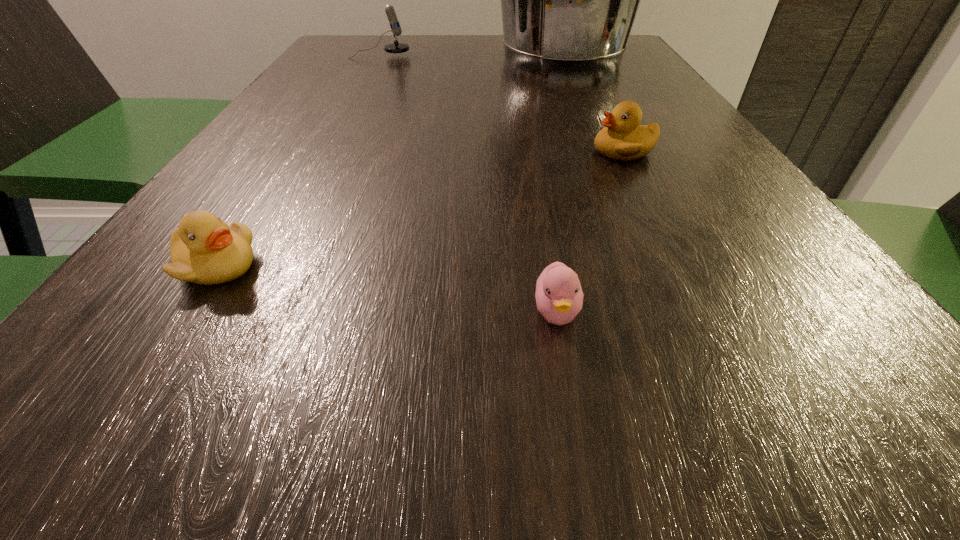
The width and height of the screenshot is (960, 540). Find the location of `the tallest object`. the tallest object is located at coordinates (569, 0).

At what (x,y) coordinates should I click in order to perform the action: click on microphone. Please return your answer as a coordinate pair (x, y). The width and height of the screenshot is (960, 540). Looking at the image, I should click on (396, 47).

Locate an element on the screen. The width and height of the screenshot is (960, 540). the third nearest object is located at coordinates (623, 138).

Where is `the rightmost duckling`? the rightmost duckling is located at coordinates (623, 138).

This screenshot has width=960, height=540. What are the coordinates of `the leftmost duckling` in the screenshot? It's located at (204, 250).

Where is `the second duckling from left to right`? the second duckling from left to right is located at coordinates (559, 297).

The image size is (960, 540). In order to click on vacant region located on the front of the tallest object in this screenshot , I will do `click(587, 112)`.

This screenshot has width=960, height=540. In order to click on free space located 0.300m on the right of the second tallest object in this screenshot , I will do `click(526, 56)`.

What are the coordinates of `free point located 0.320m at the beak of the rightmost duckling` in the screenshot? It's located at (407, 151).

The height and width of the screenshot is (540, 960). Identify the location of blank area located at the beak of the rightmost duckling. (384, 151).